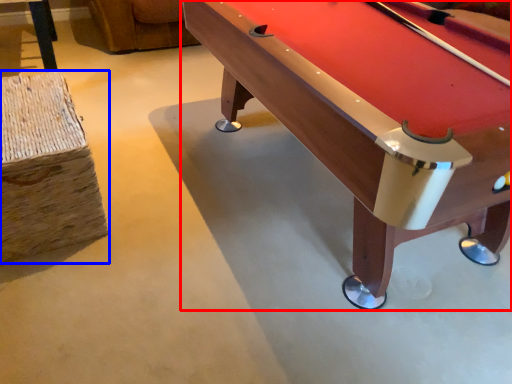
Question: Among these objects, which one is farthest to the camera, billiard table (highlighted by a red box) or bar stool (highlighted by a blue box)?

Choices:
 (A) billiard table
 (B) bar stool

Answer: (B)